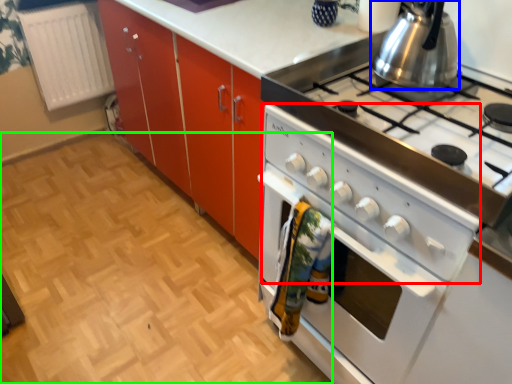
Question: Estimate the real-world distances between objects in this image. Which object is closer to wide (highlighted by a red box), kitchen appliance (highlighted by a blue box) or plain (highlighted by a green box)?

Choices:
 (A) kitchen appliance
 (B) plain

Answer: (A)